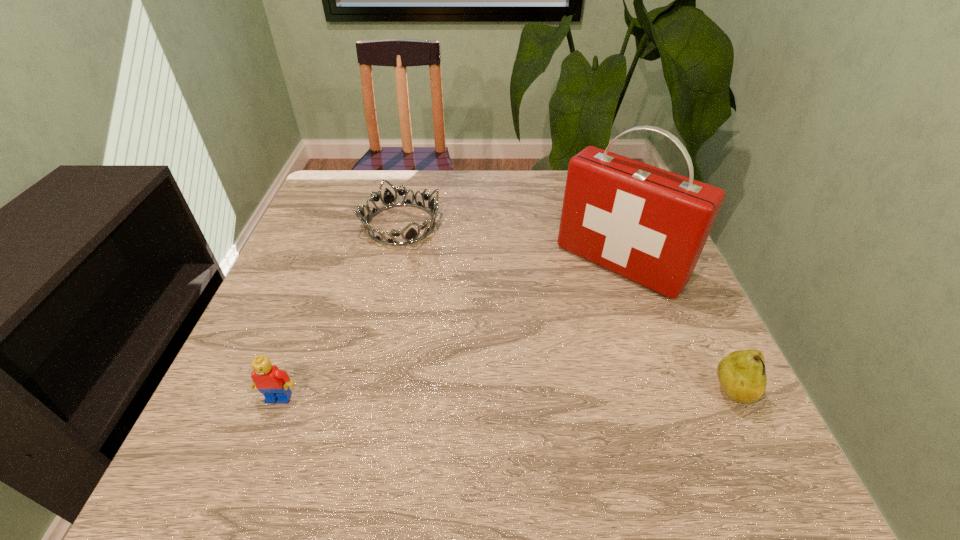
Identify the location of object that is positioned at the near left corner. The width and height of the screenshot is (960, 540). (273, 383).

Locate an element on the screen. The image size is (960, 540). object located in the near right corner section of the desktop is located at coordinates (742, 374).

Find the location of a particular element. The image size is (960, 540). vacant space at the far edge is located at coordinates (452, 190).

In order to click on vacant position at the near edge of the desktop in this screenshot , I will do `click(570, 413)`.

Where is `blank space at the left edge of the desktop`? The image size is (960, 540). blank space at the left edge of the desktop is located at coordinates (319, 280).

Where is `vacant space at the right edge of the desktop`? The image size is (960, 540). vacant space at the right edge of the desktop is located at coordinates (631, 302).

Identify the location of free area in between the second object from left to right and the first-aid kit. Image resolution: width=960 pixels, height=540 pixels. (510, 245).

The width and height of the screenshot is (960, 540). In order to click on empty space between the tallest object and the leftmost object in this screenshot , I will do `click(449, 331)`.

The height and width of the screenshot is (540, 960). What are the coordinates of `free spot between the Lego and the shortest object` in the screenshot? It's located at (340, 311).

Locate an element on the screen. This screenshot has width=960, height=540. vacant area between the shortest object and the leftmost object is located at coordinates (340, 311).